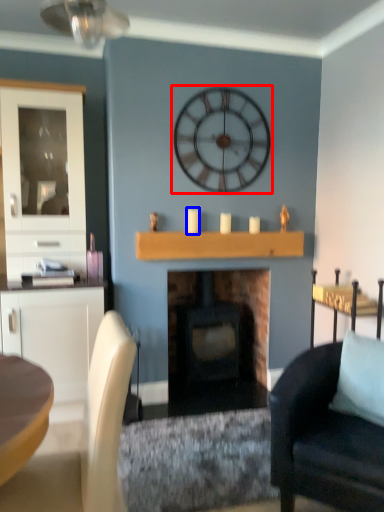
Question: Which point is closer to the camera, wall clock (highlighted by a red box) or candle (highlighted by a blue box)?

Choices:
 (A) wall clock
 (B) candle

Answer: (A)